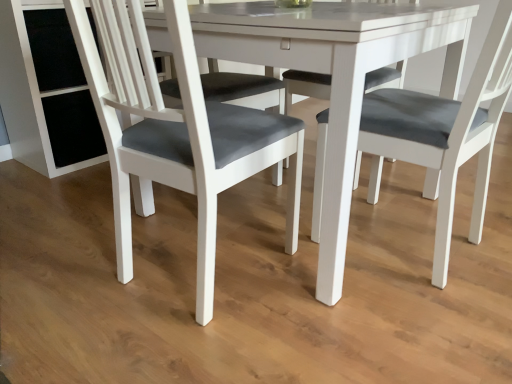
Question: In the image, is white glossy table at center positioned in front of or behind matte gray fabric chair at left?

Choices:
 (A) behind
 (B) front

Answer: (A)

Question: Considering the positions of white glossy table at center and matte gray fabric chair at left in the image, is white glossy table at center wider or thinner than matte gray fabric chair at left?

Choices:
 (A) wide
 (B) thin

Answer: (A)

Question: Choose the correct answer: Is white glossy table at center inside matte gray fabric chair at left or outside it?

Choices:
 (A) outside
 (B) inside

Answer: (A)

Question: From a real-world perspective, is matte gray fabric chair at left physically located above or below white glossy table at center?

Choices:
 (A) below
 (B) above

Answer: (B)

Question: Considering the positions of matte gray fabric chair at left and white glossy table at center in the image, is matte gray fabric chair at left taller or shorter than white glossy table at center?

Choices:
 (A) short
 (B) tall

Answer: (B)

Question: Is matte gray fabric chair at left to the left or to the right of white glossy table at center in the image?

Choices:
 (A) right
 (B) left

Answer: (B)

Question: Relative to white glossy table at center, is matte gray fabric chair at left in front or behind?

Choices:
 (A) behind
 (B) front

Answer: (B)